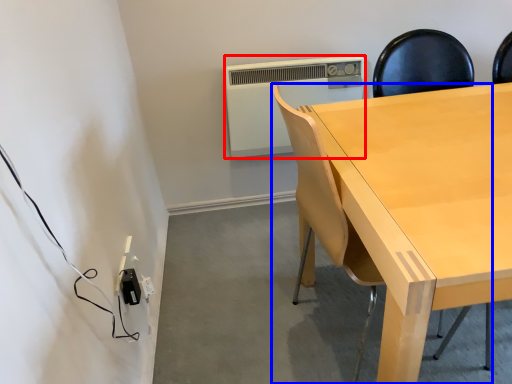
Question: Which of the following is the farthest to the observer, air conditioning (highlighted by a red box) or chair (highlighted by a blue box)?

Choices:
 (A) air conditioning
 (B) chair

Answer: (A)